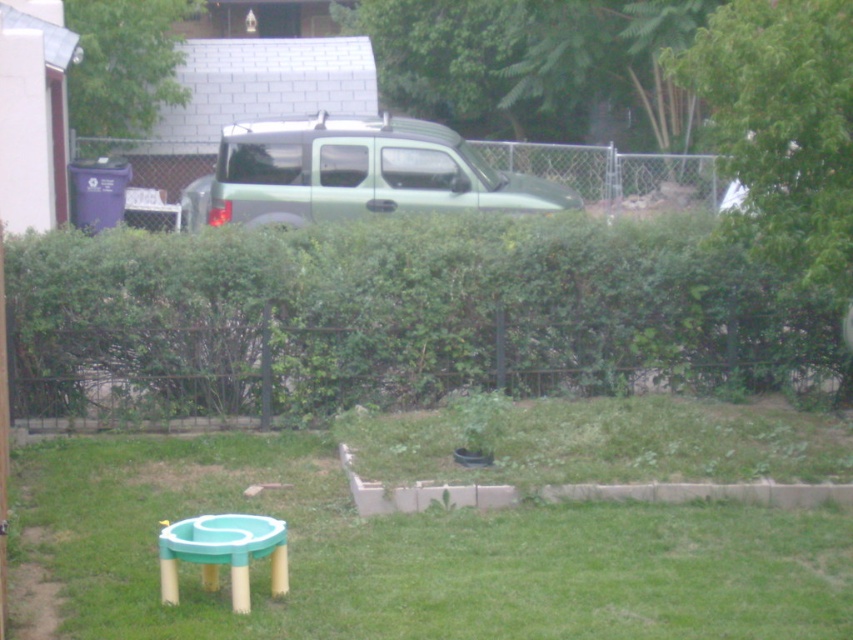
Question: Among these points, which one is farthest from the camera?

Choices:
 (A) (170, 387)
 (B) (477, 188)
 (C) (97, 32)

Answer: (C)

Question: Can you confirm if green matte suv at center is positioned above teal plastic stool at lower left?

Choices:
 (A) yes
 (B) no

Answer: (A)

Question: Among these objects, which one is farthest from the camera?

Choices:
 (A) teal plastic stool at lower left
 (B) green matte suv at center

Answer: (B)

Question: Can you confirm if green matte suv at center is wider than green leafy bush at upper center?

Choices:
 (A) no
 (B) yes

Answer: (B)

Question: Which point is farther to the camera?

Choices:
 (A) green leafy bush at upper center
 (B) teal plastic stool at lower left
 (C) green grass at lower center

Answer: (A)

Question: Is green leafy hedge at center thinner than green grass at lower center?

Choices:
 (A) yes
 (B) no

Answer: (B)